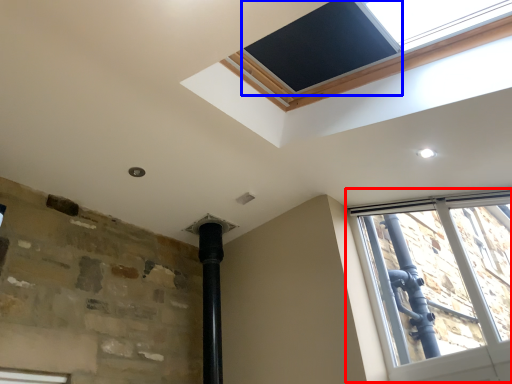
Question: Which object appears farthest to the camera in this image, window (highlighted by a red box) or window screen (highlighted by a blue box)?

Choices:
 (A) window
 (B) window screen

Answer: (A)